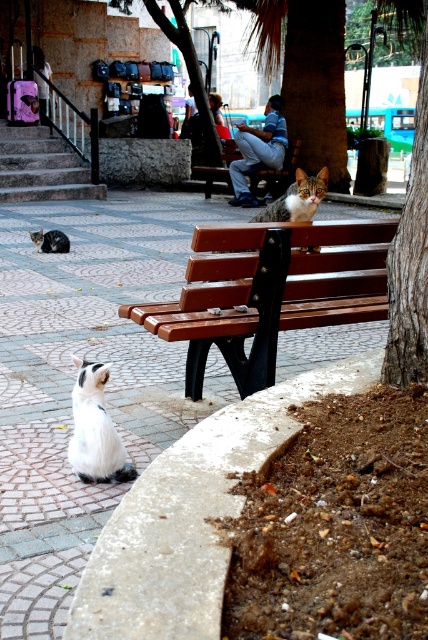
In the scene shown: You are a photographer trying to capture both the green textured tree at center and the gray fur cat at center in a single frame. Based on their sizes, would you need to adjust your camera angle to include both?

The green textured tree at center might be wider than gray fur cat at center, so you may need to adjust your camera angle to ensure both fit in the frame.

Consider the image. You are a photographer trying to capture a photo of the brown wooden bench at center and the green textured tree at center. Based on their positions, which object should you focus on first if you want to include both in your frame without moving the camera?

The brown wooden bench at center should be focused on first because the green textured tree at center is positioned on the right side of it, meaning the bench is closer to the camera and occupies the foreground. By focusing on the bench first, the tree will naturally fall into the background of the frame.